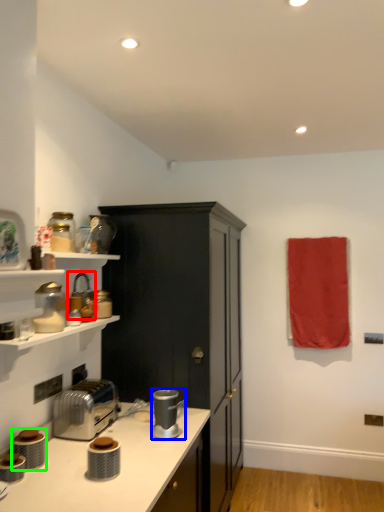
Question: Which object is positioned farthest from appliance (highlighted by a red box)? Select from coffee machine (highlighted by a blue box) and appliance (highlighted by a green box).

Choices:
 (A) coffee machine
 (B) appliance

Answer: (B)